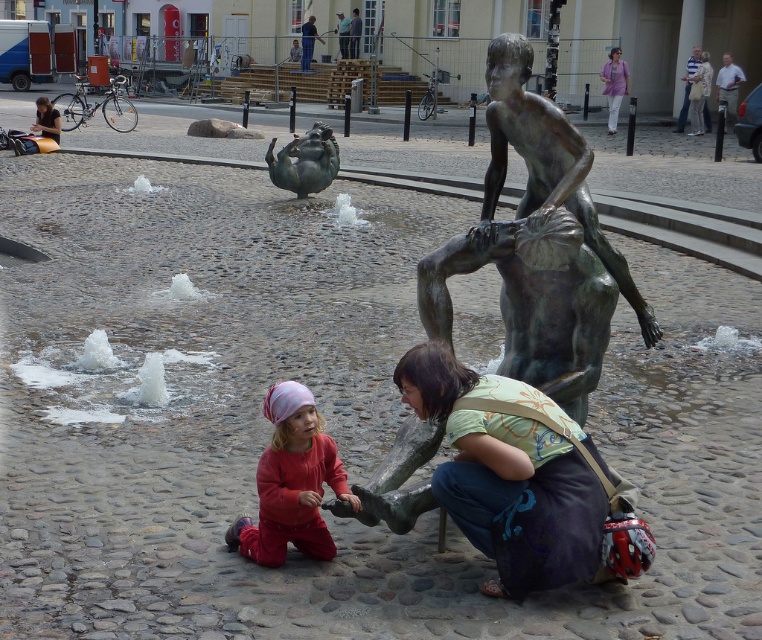
Which is in front, point (487, 538) or point (604, 68)?

Point (487, 538)

Is point (612, 484) closer to viewer compared to point (613, 116)?

Yes.

Who is more distant from viewer, (623, 576) or (626, 88)?

The point (626, 88) is more distant.

Locate an element on the screen. The height and width of the screenshot is (640, 762). bronze statue at lower center is located at coordinates (520, 477).

Which of these two, bronze sculpture at center or light purple fabric shirt at upper right, stands taller?

Standing taller between the two is light purple fabric shirt at upper right.

Locate an element on the screen. The width and height of the screenshot is (762, 640). bronze sculpture at center is located at coordinates (303, 161).

This screenshot has width=762, height=640. What do you see at coordinates (303, 161) in the screenshot?
I see `bronze sculpture at center` at bounding box center [303, 161].

Locate an element on the screen. The width and height of the screenshot is (762, 640). bronze sculpture at center is located at coordinates (303, 161).

Between bronze statue at lower center and bronze sculpture at center, which one has more height?

bronze statue at lower center is taller.

Which is in front, point (514, 401) or point (309, 160)?

Point (514, 401) is more forward.

Is point (565, 528) less distant than point (280, 172)?

Yes.

You are a GUI agent. You are given a task and a screenshot of the screen. Output one action in this format:
    pyautogui.click(x=<x>, y=<y>)
    Task: Click on the bronze statue at lower center
    This screenshot has height=640, width=762.
    Given the screenshot: What is the action you would take?
    pyautogui.click(x=520, y=477)